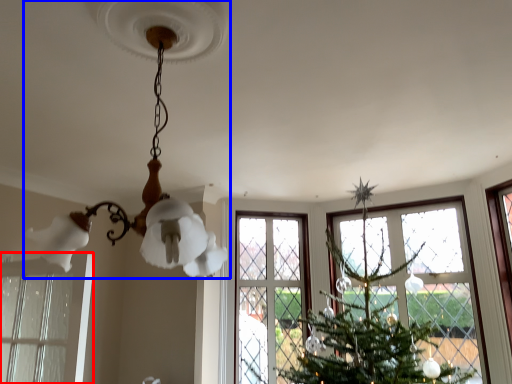
Question: Which object is closer to the camera taking this photo, window (highlighted by a red box) or lamp (highlighted by a blue box)?

Choices:
 (A) window
 (B) lamp

Answer: (B)